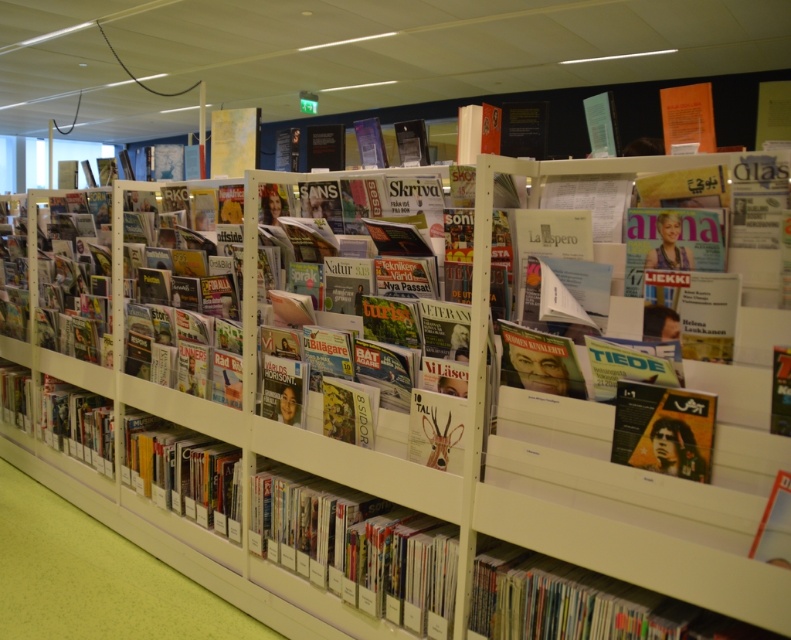
Question: In this image, where is matte plastic books at center located relative to matte black book at lower left?

Choices:
 (A) right
 (B) left

Answer: (A)

Question: Which is farther from the yellow matte book at center?

Choices:
 (A) matte black book at lower left
 (B) matte plastic books at center

Answer: (A)

Question: Which point is closer to the camera?

Choices:
 (A) (153, 497)
 (B) (42, 412)
 (C) (371, 589)

Answer: (C)

Question: Can you confirm if matte plastic books at center is smaller than matte cardboard book at lower right?

Choices:
 (A) no
 (B) yes

Answer: (A)

Question: Is matte plastic books at center above matte cardboard book at lower right?

Choices:
 (A) yes
 (B) no

Answer: (B)

Question: Based on their relative distances, which object is nearer to the matte black book at lower left?

Choices:
 (A) yellow matte book at center
 (B) matte plastic books at center
 (C) matte cardboard book at lower right

Answer: (A)